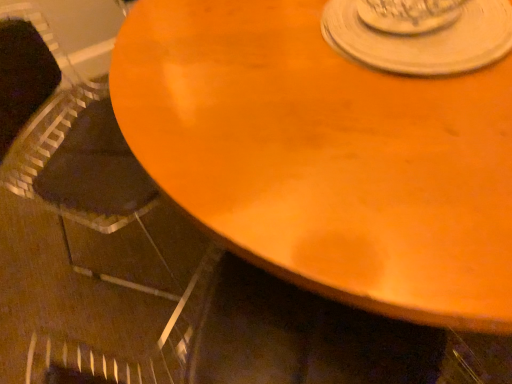
Question: Can you confirm if white matte saucer at upper center is smaller than wooden table at center?

Choices:
 (A) no
 (B) yes

Answer: (B)

Question: Is white matte saucer at upper center completely or partially outside of wooden table at center?

Choices:
 (A) no
 (B) yes

Answer: (B)

Question: Does white matte saucer at upper center have a greater height compared to wooden table at center?

Choices:
 (A) yes
 (B) no

Answer: (B)

Question: Considering the relative sizes of white matte saucer at upper center and wooden table at center in the image provided, is white matte saucer at upper center shorter than wooden table at center?

Choices:
 (A) no
 (B) yes

Answer: (B)

Question: Is white matte saucer at upper center bigger than wooden table at center?

Choices:
 (A) yes
 (B) no

Answer: (B)

Question: Is wooden table at center at the back of white matte saucer at upper center?

Choices:
 (A) yes
 (B) no

Answer: (B)

Question: From a real-world perspective, does wooden table at center sit lower than black fabric armchair at left?

Choices:
 (A) yes
 (B) no

Answer: (A)

Question: Can we say wooden table at center lies outside black fabric armchair at left?

Choices:
 (A) no
 (B) yes

Answer: (B)

Question: Is wooden table at center positioned with its back to black fabric armchair at left?

Choices:
 (A) yes
 (B) no

Answer: (B)

Question: From the image's perspective, is wooden table at center over black fabric armchair at left?

Choices:
 (A) yes
 (B) no

Answer: (A)

Question: Is wooden table at center at the left side of black fabric armchair at left?

Choices:
 (A) no
 (B) yes

Answer: (A)

Question: Considering the relative positions of wooden table at center and black fabric armchair at left in the image provided, is wooden table at center to the right of black fabric armchair at left from the viewer's perspective?

Choices:
 (A) yes
 (B) no

Answer: (A)

Question: From the image's perspective, is black fabric armchair at left above white matte saucer at upper center?

Choices:
 (A) no
 (B) yes

Answer: (A)